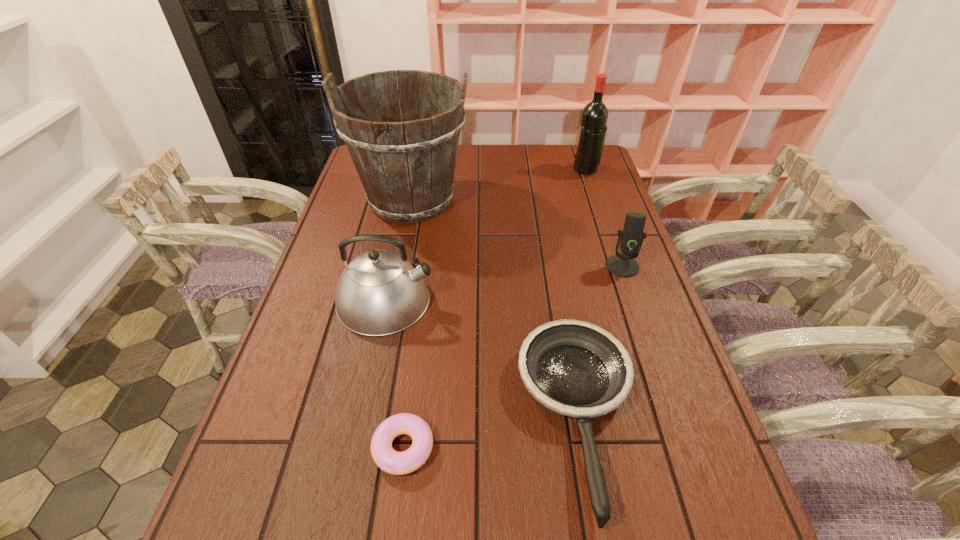
Locate an element on the screen. Image resolution: width=960 pixels, height=540 pixels. object that is at the far right corner is located at coordinates (594, 116).

The height and width of the screenshot is (540, 960). Find the location of `blank space at the far edge of the desktop`. blank space at the far edge of the desktop is located at coordinates (459, 172).

The image size is (960, 540). Identify the location of blank space at the left edge. (332, 225).

Find the location of `blank space at the right edge of the desktop`. blank space at the right edge of the desktop is located at coordinates (637, 328).

This screenshot has height=540, width=960. In the image, there is a desktop. Identify the location of vacant area at the far right corner. (567, 174).

Find the location of `unoccupied position between the third object from right to left and the second tallest object`. unoccupied position between the third object from right to left and the second tallest object is located at coordinates click(582, 293).

At what (x,y) coordinates should I click in order to perform the action: click on vacant point located between the frying pan and the shortest object. Please return your answer as a coordinate pair (x, y). The image size is (960, 540). Looking at the image, I should click on (491, 432).

Image resolution: width=960 pixels, height=540 pixels. In order to click on vacant space that's between the third tallest object and the second shortest object in this screenshot , I will do `click(482, 359)`.

The image size is (960, 540). In order to click on free space between the doughnut and the third shortest object in this screenshot , I will do `click(513, 357)`.

Where is `free area in between the shortest object and the third shortest object`? This screenshot has height=540, width=960. free area in between the shortest object and the third shortest object is located at coordinates (513, 357).